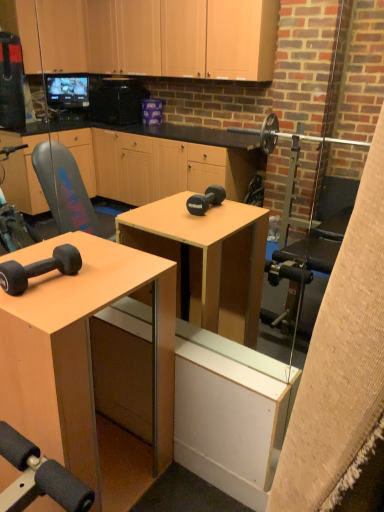
Question: From the image's perspective, is matte black dumbbell at lower left above or below matte wood desk at center?

Choices:
 (A) above
 (B) below

Answer: (A)

Question: Considering the positions of matte black dumbbell at lower left and matte wood desk at center in the image, is matte black dumbbell at lower left wider or thinner than matte wood desk at center?

Choices:
 (A) thin
 (B) wide

Answer: (A)

Question: From a real-world perspective, is matte black dumbbell at lower left above or below matte wood desk at center?

Choices:
 (A) below
 (B) above

Answer: (B)

Question: In terms of size, does matte wood desk at center appear bigger or smaller than matte black dumbbell at lower left?

Choices:
 (A) big
 (B) small

Answer: (A)

Question: Is matte wood desk at center to the left or to the right of matte black dumbbell at lower left in the image?

Choices:
 (A) left
 (B) right

Answer: (A)

Question: From the image's perspective, is matte wood desk at center positioned above or below matte black dumbbell at lower left?

Choices:
 (A) above
 (B) below

Answer: (B)

Question: Considering their positions, is matte wood desk at center located in front of or behind matte black dumbbell at lower left?

Choices:
 (A) front
 (B) behind

Answer: (A)